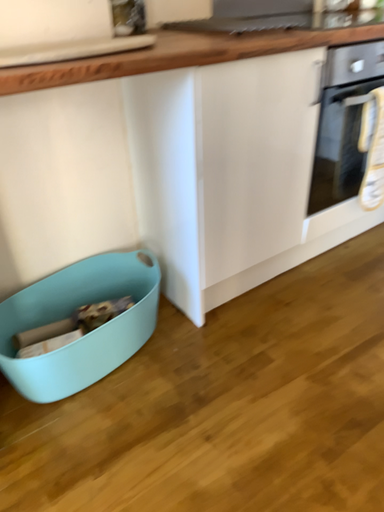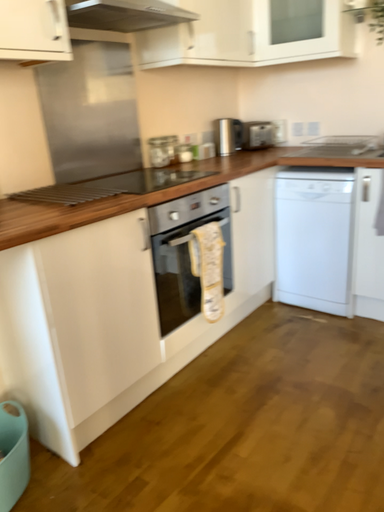
Question: Which way did the camera rotate in the video?

Choices:
 (A) rotated upward
 (B) rotated downward

Answer: (A)